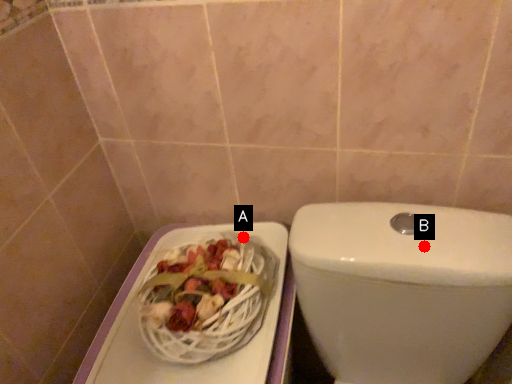
Question: Two points are circled on the image, labeled by A and B beside each circle. Which of the following is the closest to the observer?

Choices:
 (A) A is closer
 (B) B is closer

Answer: (B)